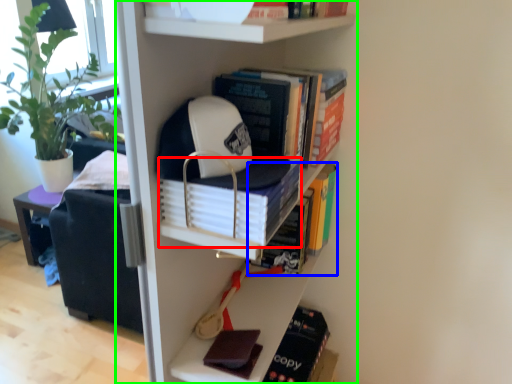
Question: Which is nearer to the book (highlighted by a red box)? book (highlighted by a blue box) or bookcase (highlighted by a green box).

Choices:
 (A) book
 (B) bookcase

Answer: (B)